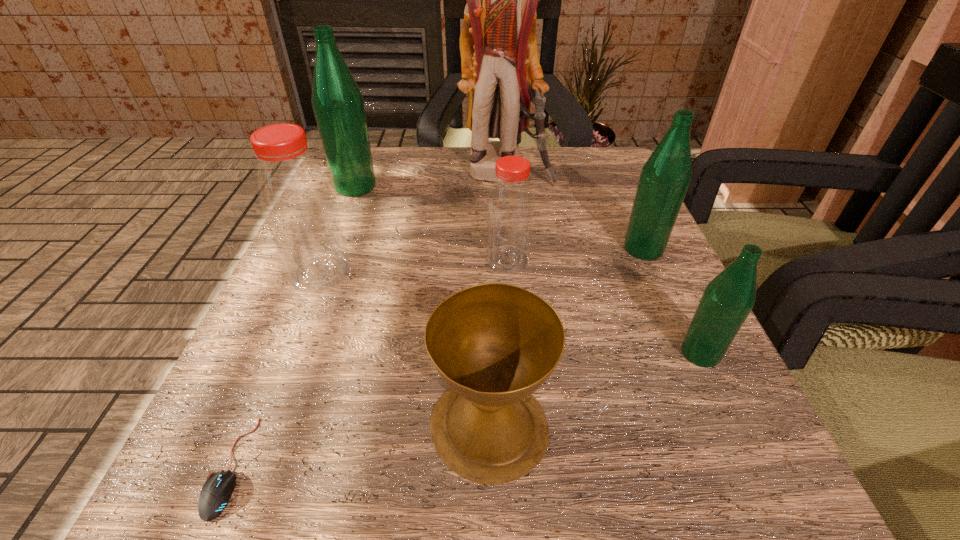
Select which green bottle is the closest to the smaller red bottle. Please provide its 2D coordinates. Your answer should be formatted as a tuple, i.e. [(x, y)], where the tuple contains the x and y coordinates of a point satisfying the conditions above.

[(665, 177)]

Locate an element on the screen. vacant space that satisfies the following two spatial constraints: 1. on the front-facing side of the nearest bottle; 2. on the left side of the red nutcracker is located at coordinates (522, 353).

Find the location of a particular element. Image resolution: width=960 pixels, height=540 pixels. free space that satisfies the following two spatial constraints: 1. on the front-facing side of the second nearest green bottle; 2. on the right side of the nutcracker is located at coordinates (513, 249).